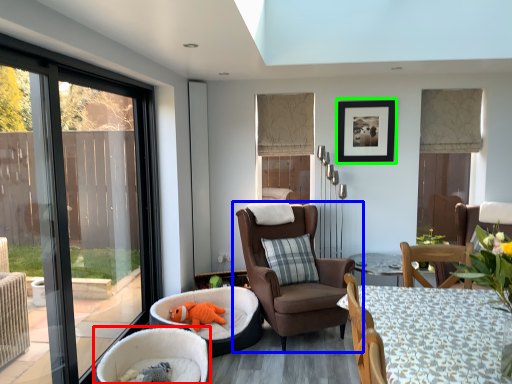
Question: Which object is positioned closest to chair (highlighted by a red box)? Select from chair (highlighted by a blue box) and picture frame (highlighted by a green box).

Choices:
 (A) chair
 (B) picture frame

Answer: (A)